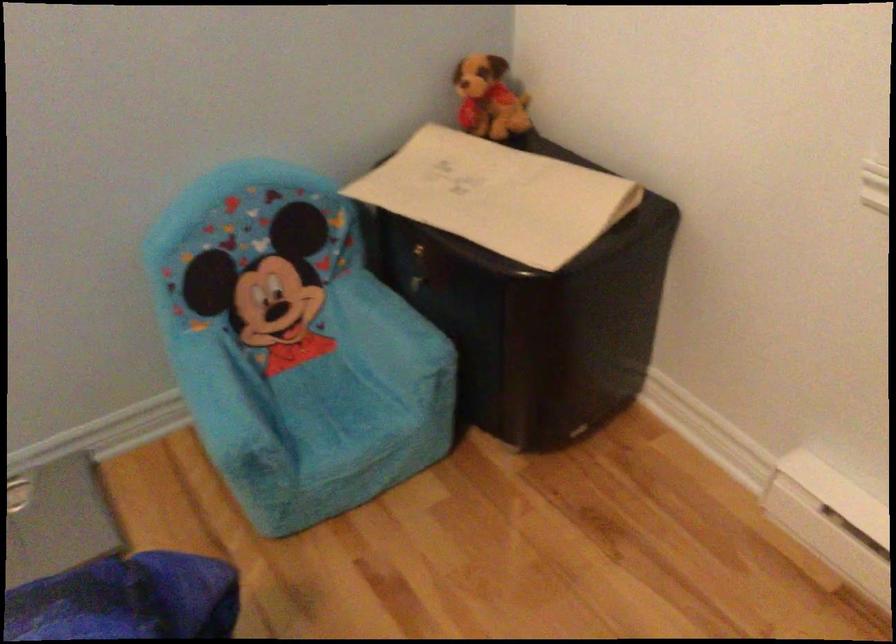
What do you see at coordinates (419, 292) in the screenshot?
I see `the cabinet drawer handle` at bounding box center [419, 292].